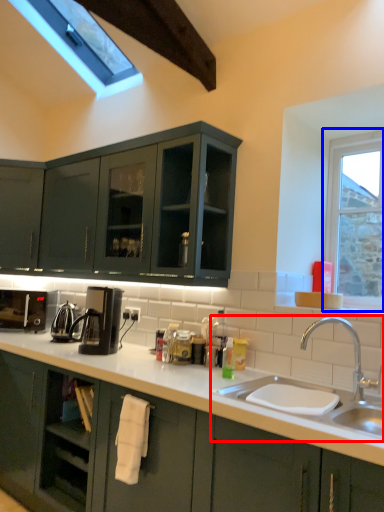
Question: Which point is closer to the camera, sink (highlighted by a red box) or window (highlighted by a blue box)?

Choices:
 (A) sink
 (B) window

Answer: (A)